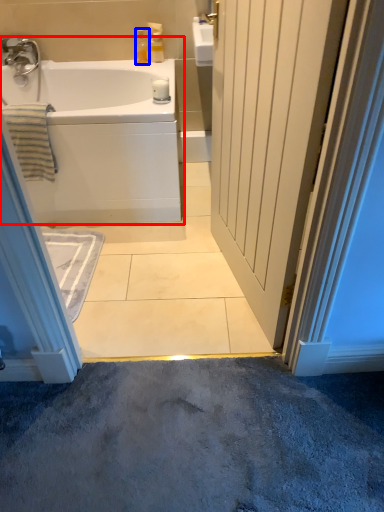
Question: Which object appears closest to the camera in this image, bathtub (highlighted by a red box) or toiletry (highlighted by a blue box)?

Choices:
 (A) bathtub
 (B) toiletry

Answer: (A)